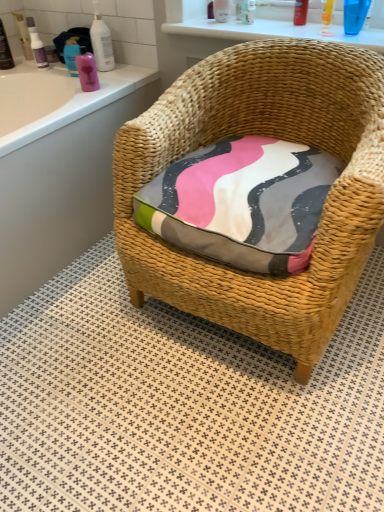
Where is `unoccupied area in front of translucent plastic bottle at upper center, which is the eighth toiletry in left-to-right order`? The width and height of the screenshot is (384, 512). unoccupied area in front of translucent plastic bottle at upper center, which is the eighth toiletry in left-to-right order is located at coordinates (253, 28).